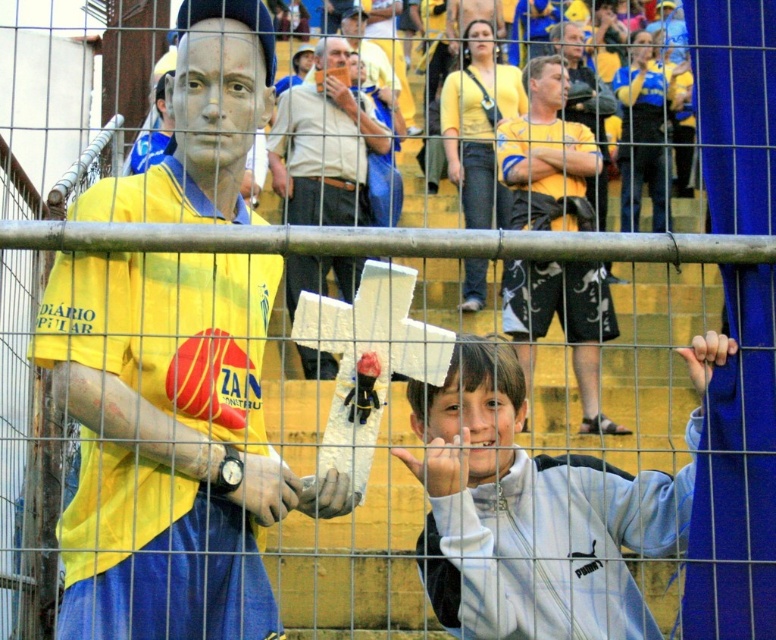
Who is positioned more to the left, matte white mask at center or yellow jersey at center?

From the viewer's perspective, matte white mask at center appears more on the left side.

Does matte white mask at center have a greater height compared to yellow jersey at center?

Yes, matte white mask at center is taller than yellow jersey at center.

Measure the distance between matte white mask at center and camera.

A distance of 182.84 feet exists between matte white mask at center and camera.

Where is `matte white mask at center`? The image size is (776, 640). matte white mask at center is located at coordinates (324, 154).

Who is taller, yellow matte shirt at left or yellow jersey at center?

yellow matte shirt at left

Which is more to the left, yellow matte shirt at left or yellow jersey at center?

From the viewer's perspective, yellow matte shirt at left appears more on the left side.

Does point (201, 376) come in front of point (586, 100)?

That is True.

You are a GUI agent. You are given a task and a screenshot of the screen. Output one action in this format:
    pyautogui.click(x=<x>, y=<y>)
    Task: Click on the yellow matte shirt at left
    
    Given the screenshot: What is the action you would take?
    pyautogui.click(x=168, y=444)

Who is positioned more to the left, yellow matte shirt at left or white matte jacket at lower right?

yellow matte shirt at left

Which is more to the right, yellow matte shirt at left or white matte jacket at lower right?

white matte jacket at lower right

Where is `yellow matte shirt at left`? The height and width of the screenshot is (640, 776). yellow matte shirt at left is located at coordinates (168, 444).

You are a GUI agent. You are given a task and a screenshot of the screen. Output one action in this format:
    pyautogui.click(x=<x>, y=<y>)
    Task: Click on the yellow matte shirt at left
    The height and width of the screenshot is (640, 776).
    Given the screenshot: What is the action you would take?
    click(168, 444)